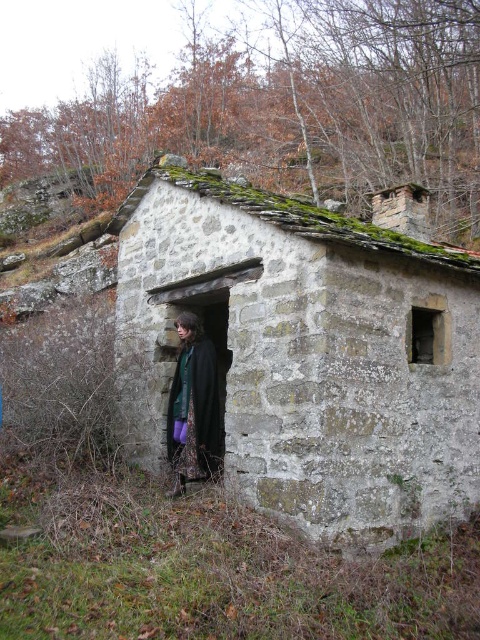
You are a hiker lost in the forest and you come across the stone textured hut at center and the black woolen coat at center. Which object is bigger in size?

The stone textured hut at center is larger in size compared to the black woolen coat at center.